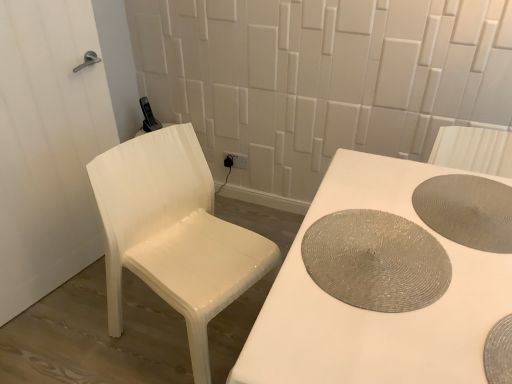
Question: From a real-world perspective, relative to white glossy door at left, is silver textured placemat at bottom right, acting as the first manhole cover starting from the front, vertically above or below?

Choices:
 (A) above
 (B) below

Answer: (A)

Question: Considering the positions of silver textured placemat at bottom right, acting as the first manhole cover starting from the front, and white glossy door at left in the image, is silver textured placemat at bottom right, acting as the first manhole cover starting from the front, bigger or smaller than white glossy door at left?

Choices:
 (A) big
 (B) small

Answer: (B)

Question: Which object is the closest to the white glossy chair at left?

Choices:
 (A) white glossy door at left
 (B) silver textured placemat at bottom right, acting as the first manhole cover starting from the front
 (C) shiny metallic placemat at table right, placed as the 2th manhole cover when sorted from front to back
 (D) matte gray placemat at right, the 1th manhole cover when ordered from back to front

Answer: (A)

Question: Which is farther from the matte gray placemat at right, the 3th manhole cover from the front?

Choices:
 (A) white glossy chair at left
 (B) shiny metallic placemat at table right, arranged as the second manhole cover when viewed from the back
 (C) silver textured placemat at bottom right, acting as the first manhole cover starting from the front
 (D) white glossy door at left

Answer: (D)